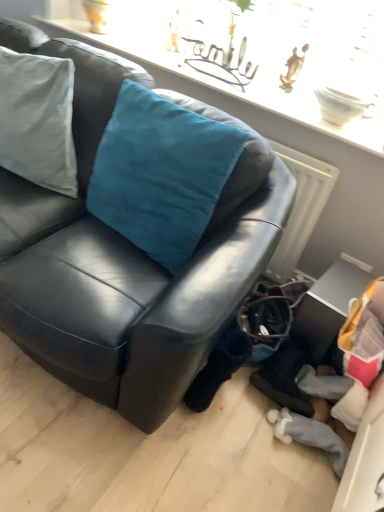
Question: Considering the relative sizes of teal velvet cushion at upper left and metallic silver table at lower right in the image provided, is teal velvet cushion at upper left wider than metallic silver table at lower right?

Choices:
 (A) yes
 (B) no

Answer: (B)

Question: Does teal velvet cushion at upper left have a lesser width compared to metallic silver table at lower right?

Choices:
 (A) no
 (B) yes

Answer: (B)

Question: Does teal velvet cushion at upper left have a smaller size compared to metallic silver table at lower right?

Choices:
 (A) no
 (B) yes

Answer: (A)

Question: Is teal velvet cushion at upper left behind metallic silver table at lower right?

Choices:
 (A) yes
 (B) no

Answer: (B)

Question: Is teal velvet cushion at upper left not near metallic silver table at lower right?

Choices:
 (A) no
 (B) yes

Answer: (A)

Question: Could you tell me if teal velvet cushion at upper left is turned towards metallic silver table at lower right?

Choices:
 (A) no
 (B) yes

Answer: (A)

Question: Is metallic silver table at lower right positioned with its back to satin teal cushion at upper center?

Choices:
 (A) no
 (B) yes

Answer: (A)

Question: Does metallic silver table at lower right lie in front of satin teal cushion at upper center?

Choices:
 (A) yes
 (B) no

Answer: (A)

Question: Is metallic silver table at lower right aimed at satin teal cushion at upper center?

Choices:
 (A) no
 (B) yes

Answer: (A)

Question: From the image's perspective, is metallic silver table at lower right beneath satin teal cushion at upper center?

Choices:
 (A) no
 (B) yes

Answer: (B)

Question: Is metallic silver table at lower right to the right of satin teal cushion at upper center from the viewer's perspective?

Choices:
 (A) no
 (B) yes

Answer: (B)

Question: Would you consider metallic silver table at lower right to be distant from satin teal cushion at upper center?

Choices:
 (A) yes
 (B) no

Answer: (B)

Question: From the image's perspective, is teal velvet cushion at upper left below black leather couch at center?

Choices:
 (A) no
 (B) yes

Answer: (A)